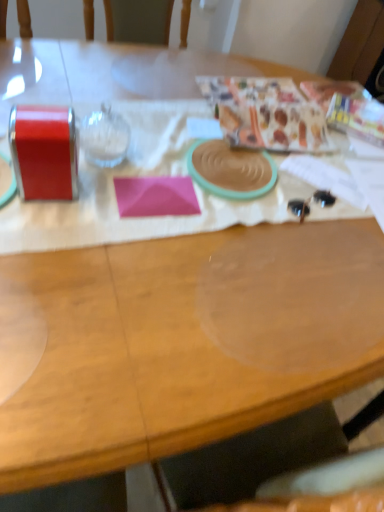
Question: Is point (142, 188) closer or farther from the camera than point (253, 86)?

Choices:
 (A) farther
 (B) closer

Answer: (B)

Question: Choose the correct answer: Is pink matte paper at center inside matte plastic bag at upper right, arranged as the 2th wrapping paper when viewed from the right, or outside it?

Choices:
 (A) outside
 (B) inside

Answer: (A)

Question: Estimate the real-world distances between objects in this image. Which object is closer to the transparent glass at upper left?

Choices:
 (A) patterned paper at upper right, which is counted as the 2th wrapping paper, starting from the left
 (B) matte plastic bag at upper right, arranged as the 2th wrapping paper when viewed from the right
 (C) pink matte paper at center

Answer: (C)

Question: Estimate the real-world distances between objects in this image. Which object is closer to the matte plastic bag at upper right, arranged as the 2th wrapping paper when viewed from the right?

Choices:
 (A) transparent glass at upper left
 (B) patterned paper at upper right, which is counted as the 2th wrapping paper, starting from the left
 (C) pink matte paper at center

Answer: (B)